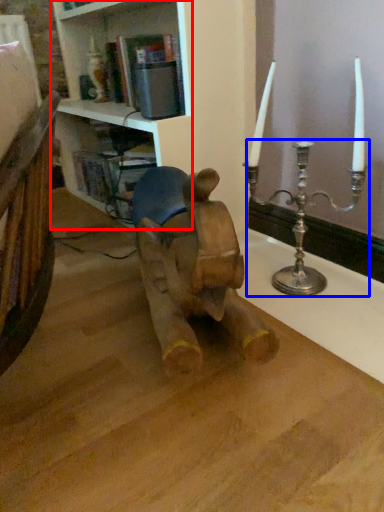
Question: Which object appears farthest to the camera in this image, shelf (highlighted by a red box) or candle holder (highlighted by a blue box)?

Choices:
 (A) shelf
 (B) candle holder

Answer: (B)